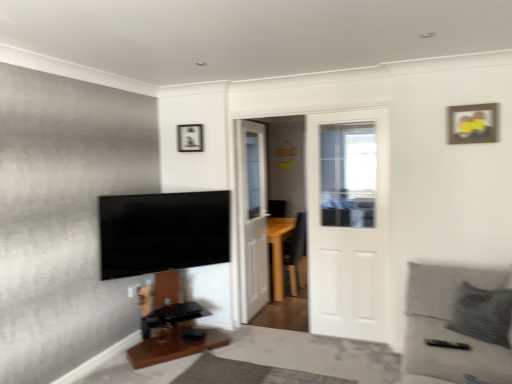
This screenshot has width=512, height=384. In order to click on flat screen tv at left in this screenshot , I will do `click(163, 232)`.

In order to face white wooden door at center, the 2th door when ordered from back to front, should I rotate leftwards or rightwards?

Turn right approximately 11.919 degrees to face it.

Image resolution: width=512 pixels, height=384 pixels. What do you see at coordinates (174, 336) in the screenshot? I see `wooden table at lower center` at bounding box center [174, 336].

In order to face wooden picture frame at upper center, which is counted as the 1th picture frame, starting from the left, should I rotate leftwards or rightwards?

Rotate your view left by about 8.942°.

The height and width of the screenshot is (384, 512). In order to click on gray fabric couch at lower right in this screenshot , I will do point(448,329).

The width and height of the screenshot is (512, 384). Find the location of `flat screen tv at left`. flat screen tv at left is located at coordinates [163, 232].

Visually, is white wooden door at center, placed as the 1th door when sorted from left to right, positioned to the left or to the right of gray fabric couch at lower right?

From the image, it's evident that white wooden door at center, placed as the 1th door when sorted from left to right, is to the left of gray fabric couch at lower right.

Which is correct: white wooden door at center, acting as the 2th door starting from the front, is inside gray fabric couch at lower right, or outside of it?

white wooden door at center, acting as the 2th door starting from the front, is outside gray fabric couch at lower right.

Measure the distance between white wooden door at center, the 2th door viewed from the right, and gray fabric couch at lower right.

They are 1.85 meters apart.

This screenshot has width=512, height=384. Find the location of `couch on the right of white wooden door at center, the 2th door viewed from the right`. couch on the right of white wooden door at center, the 2th door viewed from the right is located at coordinates (448, 329).

Based on the photo, which of these two, flat screen tv at left or white wooden door at center, the 1th door when ordered from right to left, stands taller?

white wooden door at center, the 1th door when ordered from right to left, is taller.

Which object is further away from the camera taking this photo, flat screen tv at left or white wooden door at center, the 1th door when ordered from right to left?

white wooden door at center, the 1th door when ordered from right to left, is more distant.

Can you confirm if flat screen tv at left is positioned to the left of white wooden door at center, which is counted as the second door, starting from the left?

Yes, flat screen tv at left is to the left of white wooden door at center, which is counted as the second door, starting from the left.

From the picture: Is flat screen tv at left looking in the opposite direction of white wooden door at center, which is counted as the second door, starting from the left?

No, flat screen tv at left is not facing away from white wooden door at center, which is counted as the second door, starting from the left.

Is gray fabric couch at lower right facing towards white wooden door at center, the 2th door when ordered from back to front?

Yes, gray fabric couch at lower right faces towards white wooden door at center, the 2th door when ordered from back to front.

Based on the photo, from a real-world perspective, between gray fabric couch at lower right and white wooden door at center, which is counted as the second door, starting from the left, who is vertically higher?

From a 3D spatial view, white wooden door at center, which is counted as the second door, starting from the left, is above.

Based on the photo, how different are the orientations of gray fabric couch at lower right and white wooden door at center, the first door in the front-to-back sequence, in degrees?

They differ by 89.4 degrees in their facing directions.

Locate an element on the screen. the 1st door behind the gray fabric couch at lower right, starting your count from the anchor is located at coordinates (347, 222).

Is wooden picture frame at upper center, which is counted as the 1th picture frame, starting from the left, looking in the opposite direction of white wooden door at center, which is the 1th door in back-to-front order?

wooden picture frame at upper center, which is counted as the 1th picture frame, starting from the left, is not turned away from white wooden door at center, which is the 1th door in back-to-front order.

From a real-world perspective, between wooden picture frame at upper center, which ranks as the second picture frame in right-to-left order, and white wooden door at center, the 2th door viewed from the right, who is vertically lower?

white wooden door at center, the 2th door viewed from the right, from a real-world perspective.

How different are the orientations of wooden picture frame at upper center, which ranks as the second picture frame in right-to-left order, and white wooden door at center, which is the 1th door in back-to-front order, in degrees?

The facing directions of wooden picture frame at upper center, which ranks as the second picture frame in right-to-left order, and white wooden door at center, which is the 1th door in back-to-front order, are 91.5 degrees apart.

Is wooden picture frame at upper center, which is counted as the 1th picture frame, starting from the left, far away from white wooden door at center, the 2th door viewed from the right?

Actually, wooden picture frame at upper center, which is counted as the 1th picture frame, starting from the left, and white wooden door at center, the 2th door viewed from the right, are a little close together.

Consider the image. Is wooden picture frame at upper right, which appears as the second picture frame when viewed from the back, oriented away from wooden picture frame at upper center, which ranks as the second picture frame in right-to-left order?

That's not correct — wooden picture frame at upper right, which appears as the second picture frame when viewed from the back, is not looking away from wooden picture frame at upper center, which ranks as the second picture frame in right-to-left order.

Who is taller, wooden picture frame at upper right, which appears as the first picture frame when viewed from the front, or wooden picture frame at upper center, which ranks as the second picture frame in right-to-left order?

Standing taller between the two is wooden picture frame at upper right, which appears as the first picture frame when viewed from the front.

Considering the sizes of objects wooden picture frame at upper right, marked as the first picture frame in a right-to-left arrangement, and wooden picture frame at upper center, the first picture frame from the back, in the image provided, who is bigger, wooden picture frame at upper right, marked as the first picture frame in a right-to-left arrangement, or wooden picture frame at upper center, the first picture frame from the back,?

With larger size is wooden picture frame at upper center, the first picture frame from the back.

In the scene shown: Is wooden picture frame at upper right, which appears as the first picture frame when viewed from the front, not close to wooden picture frame at upper center, the first picture frame from the back?

Yes.

Based on the photo, from a real-world perspective, does white wooden door at center, which is counted as the second door, starting from the left, sit lower than gray fabric couch at lower right?

No, from a real-world perspective, white wooden door at center, which is counted as the second door, starting from the left, is not under gray fabric couch at lower right.

The height and width of the screenshot is (384, 512). There is a gray fabric couch at lower right. What are the coordinates of `the 2nd door above it (from a real-world perspective)` in the screenshot? It's located at (347, 222).

Looking at this image, from the image's perspective, would you say white wooden door at center, the first door in the front-to-back sequence, is positioned over gray fabric couch at lower right?

Yes, from the image's perspective, white wooden door at center, the first door in the front-to-back sequence, is over gray fabric couch at lower right.

How far apart are wooden picture frame at upper right, which appears as the second picture frame when viewed from the back, and white wooden door at center, acting as the 2th door starting from the front?

The distance of wooden picture frame at upper right, which appears as the second picture frame when viewed from the back, from white wooden door at center, acting as the 2th door starting from the front, is 6.50 feet.

Can you confirm if wooden picture frame at upper right, which appears as the first picture frame when viewed from the front, is taller than white wooden door at center, the 2th door viewed from the right?

No.

Can you confirm if wooden picture frame at upper right, which appears as the first picture frame when viewed from the front, is smaller than white wooden door at center, the 2th door viewed from the right?

Correct, wooden picture frame at upper right, which appears as the first picture frame when viewed from the front, occupies less space than white wooden door at center, the 2th door viewed from the right.

From a real-world perspective, which object stands above the other?

wooden picture frame at upper right, which appears as the second picture frame when viewed from the back, from a real-world perspective.

Find the location of `the 2nd door behind when counting from the gray fabric couch at lower right`. the 2nd door behind when counting from the gray fabric couch at lower right is located at coordinates (252, 218).

You are a GUI agent. You are given a task and a screenshot of the screen. Output one action in this format:
    pyautogui.click(x=<x>, y=<y>)
    Task: Click on the 1st door above the flat screen tv at left (from the image's perspective)
    This screenshot has height=384, width=512.
    Given the screenshot: What is the action you would take?
    pyautogui.click(x=347, y=222)

Looking at the image, which one is located closer to white wooden door at center, the first door in the front-to-back sequence, wooden picture frame at upper center, the first picture frame from the back, or white wooden door at center, acting as the 2th door starting from the front?

white wooden door at center, acting as the 2th door starting from the front, is positioned closer to the anchor white wooden door at center, the first door in the front-to-back sequence.

Considering their positions, is white wooden door at center, the 2th door viewed from the right, positioned closer to wooden picture frame at upper right, marked as the first picture frame in a right-to-left arrangement, than white wooden door at center, the first door in the front-to-back sequence?

white wooden door at center, the first door in the front-to-back sequence, is positioned closer to the anchor wooden picture frame at upper right, marked as the first picture frame in a right-to-left arrangement.

Considering their positions, is gray fabric couch at lower right positioned closer to white wooden door at center, placed as the 1th door when sorted from left to right, than flat screen tv at left?

Based on the image, flat screen tv at left appears to be nearer to white wooden door at center, placed as the 1th door when sorted from left to right.

Estimate the real-world distances between objects in this image. Which object is further from wooden table at lower center, gray fabric couch at lower right or white wooden door at center, acting as the 2th door starting from the front?

gray fabric couch at lower right is positioned further to the anchor wooden table at lower center.

From the image, which object appears to be nearer to flat screen tv at left, white wooden door at center, the 1th door when ordered from right to left, or wooden picture frame at upper center, the second picture frame from the front?

Among the two, wooden picture frame at upper center, the second picture frame from the front, is located nearer to flat screen tv at left.

Based on their spatial positions, is flat screen tv at left or wooden picture frame at upper center, which is counted as the 1th picture frame, starting from the left, closer to white wooden door at center, acting as the 2th door starting from the front?

Among the two, flat screen tv at left is located nearer to white wooden door at center, acting as the 2th door starting from the front.

Estimate the real-world distances between objects in this image. Which object is further from white wooden door at center, the 2th door viewed from the right, white wooden door at center, the 1th door when ordered from right to left, or gray fabric couch at lower right?

gray fabric couch at lower right lies further to white wooden door at center, the 2th door viewed from the right, than the other object.

Considering their positions, is gray fabric couch at lower right positioned further to wooden picture frame at upper right, which appears as the first picture frame when viewed from the front, than white wooden door at center, which is the 1th door in back-to-front order?

The object further to wooden picture frame at upper right, which appears as the first picture frame when viewed from the front, is white wooden door at center, which is the 1th door in back-to-front order.

Where is `picture frame between wooden table at lower center and wooden picture frame at upper right, marked as the first picture frame in a right-to-left arrangement, in the horizontal direction`? This screenshot has width=512, height=384. picture frame between wooden table at lower center and wooden picture frame at upper right, marked as the first picture frame in a right-to-left arrangement, in the horizontal direction is located at coordinates (190, 138).

This screenshot has height=384, width=512. Find the location of `television between gray fabric couch at lower right and white wooden door at center, the 1th door when ordered from right to left, from front to back`. television between gray fabric couch at lower right and white wooden door at center, the 1th door when ordered from right to left, from front to back is located at coordinates (163, 232).

This screenshot has width=512, height=384. Find the location of `table between flat screen tv at left and white wooden door at center, which is counted as the second door, starting from the left, in the horizontal direction`. table between flat screen tv at left and white wooden door at center, which is counted as the second door, starting from the left, in the horizontal direction is located at coordinates (174, 336).

This screenshot has width=512, height=384. Find the location of `television between wooden table at lower center and white wooden door at center, the 2th door viewed from the right, in the front-back direction`. television between wooden table at lower center and white wooden door at center, the 2th door viewed from the right, in the front-back direction is located at coordinates (163, 232).